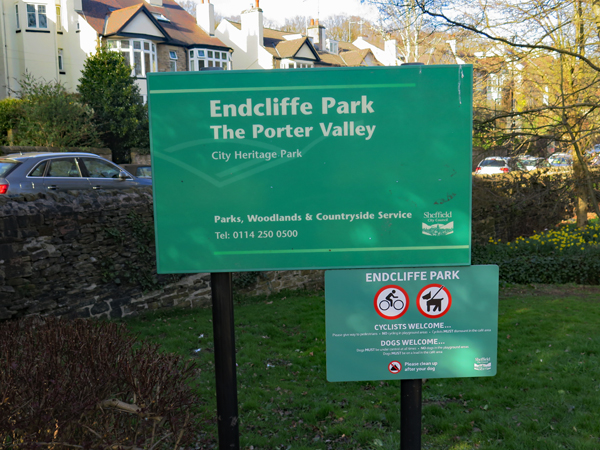
Locate an element on the screen. The width and height of the screenshot is (600, 450). opened windows is located at coordinates (173, 55), (201, 53).